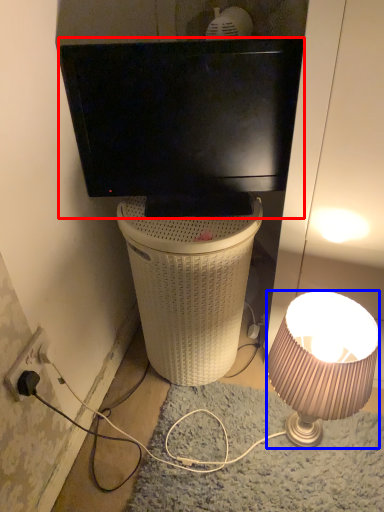
Question: Which of the following is the closest to the observer, television (highlighted by a red box) or lamp (highlighted by a blue box)?

Choices:
 (A) television
 (B) lamp

Answer: (B)